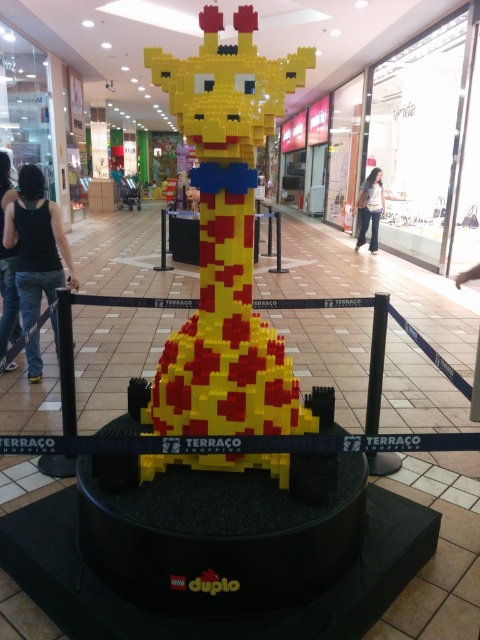
Question: Does black tank top at center have a greater width compared to denim pants at center?

Choices:
 (A) yes
 (B) no

Answer: (A)

Question: Is yellow lego giraffe at center positioned at the back of black rubber barrier at center?

Choices:
 (A) yes
 (B) no

Answer: (A)

Question: From the image, what is the correct spatial relationship of yellow lego giraffe at center in relation to black tank top at center?

Choices:
 (A) left
 (B) right

Answer: (B)

Question: Which object is the closest to the yellow lego giraffe at center?

Choices:
 (A) black rubber barrier at center
 (B) black denim jeans at lower left
 (C) black tank top at center

Answer: (A)

Question: Which object is the closest to the denim pants at center?

Choices:
 (A) black tank top at center
 (B) yellow lego giraffe at center
 (C) black denim jeans at lower left
 (D) black rubber barrier at center

Answer: (C)

Question: Which point appears farthest from the camera in this image?

Choices:
 (A) (x=79, y=301)
 (B) (x=224, y=289)
 (C) (x=374, y=244)

Answer: (C)